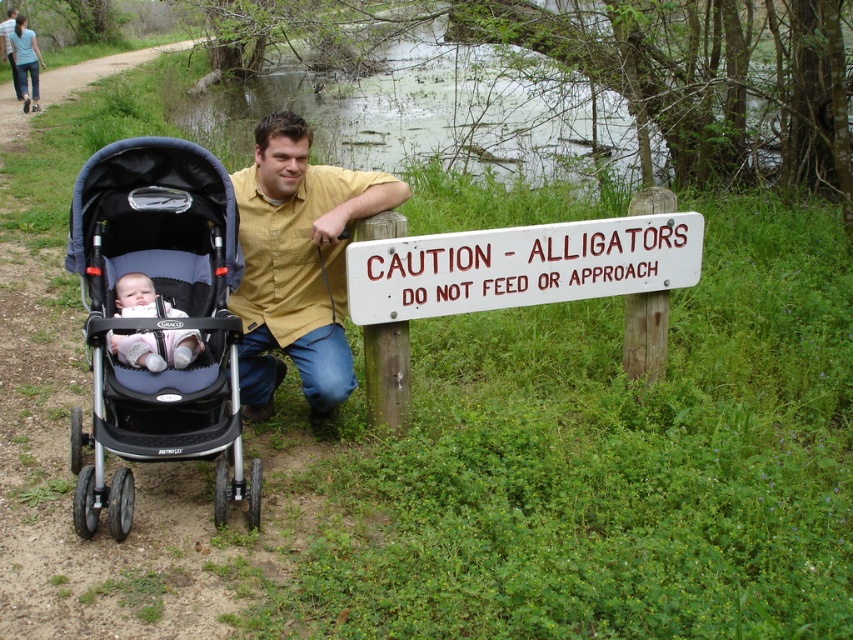
You are a parent walking with your child in the park. You see a yellow shirt at center and a white painted wood sign at center. Which object is closer to the path where the baby stroller is located?

The yellow shirt at center is closer to the path where the baby stroller is located because it is positioned to the left of the white painted wood sign at center, and the stroller is also on the left side of the sign.

Consider the image. You are a parent with a child in a stroller. You want to push the black fabric stroller at left through a narrow path that is only as wide as the yellow shirt at center. Will the stroller fit?

The black fabric stroller at left is narrower than the yellow shirt at center. Since the path is as wide as the yellow shirt at center, the stroller should fit through the path.

You are a parent walking with your child near the water. You see the black fabric stroller at left. Where should you place the stroller to ensure it stays on the dirt path and away from the water?

The black fabric stroller at left is already positioned on the dirt path at point (160, 321), so it is already in a safe location away from the water.